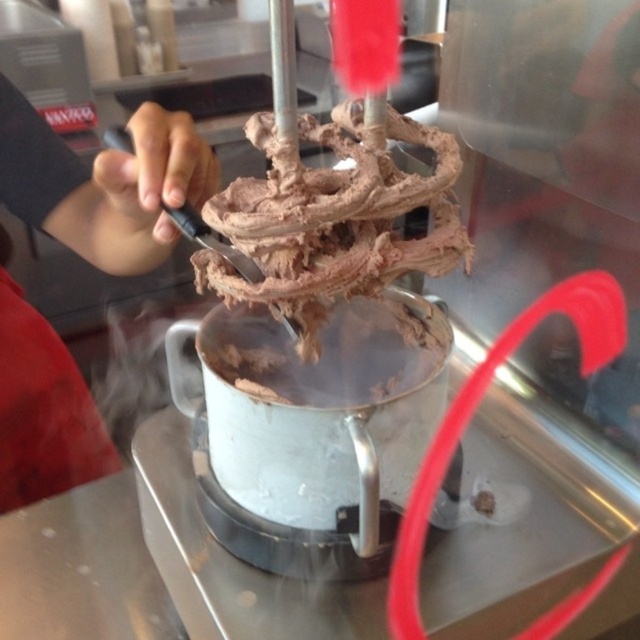
Question: Which point appears closest to the camera in this image?

Choices:
 (A) (100, 452)
 (B) (376, 186)

Answer: (B)

Question: Is smooth skin hand at upper left to the right of chocolate matte ice cream at center from the viewer's perspective?

Choices:
 (A) no
 (B) yes

Answer: (A)

Question: Is smooth skin hand at upper left closer to the viewer compared to chocolate matte ice cream at center?

Choices:
 (A) yes
 (B) no

Answer: (B)

Question: Is smooth skin hand at upper left bigger than chocolate matte ice cream at center?

Choices:
 (A) no
 (B) yes

Answer: (B)